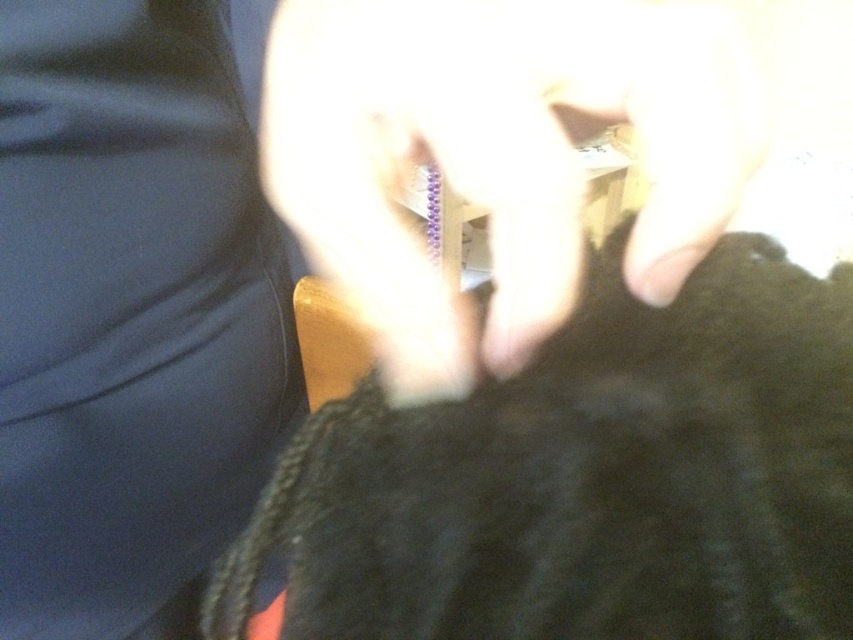
You are a photographer trying to capture the interaction between the black fuzzy fur at center and the smooth skin hand at center. Which object is located to the right of the other?

The black fuzzy fur at center is positioned on the right side of smooth skin hand at center.

In the scene shown: You are a photographer trying to focus on the object in the center of the frame. There is a point at coordinates point [587,480]. Where is this point located in relation to the black fuzzy fur at center?

The point [587,480] is located on the black fuzzy fur at center.

You are a photographer trying to capture the black fuzzy fur at center and the smooth skin hand at center in a clear shot. Based on their sizes in the image, which object would you need to focus on more carefully to ensure sharpness?

The black fuzzy fur at center is taller than the smooth skin hand at center, so you should focus more on the black fuzzy fur at center to ensure sharpness since it occupies a larger area in the frame.